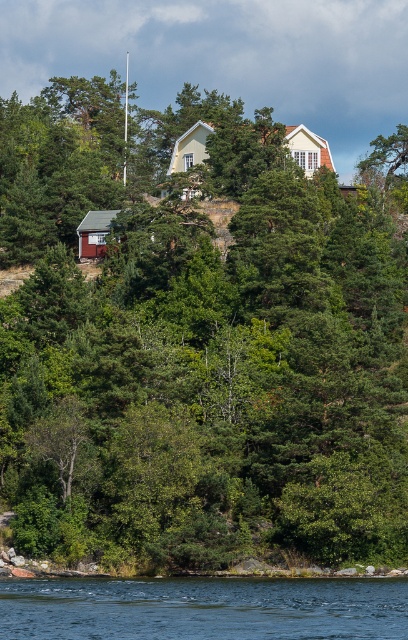
Is the position of transparent blue water at lower center more distant than that of yellow matte house at center?

No, it is in front of yellow matte house at center.

Does transparent blue water at lower center appear on the left side of yellow matte house at center?

Indeed, transparent blue water at lower center is positioned on the left side of yellow matte house at center.

Who is more distant from viewer, (x=37, y=628) or (x=168, y=164)?

Positioned behind is point (x=168, y=164).

In order to click on transparent blue water at lower center in this screenshot , I will do `click(204, 609)`.

Can you confirm if yellow matte house at center is smaller than red wooden hut at lower left?

No, yellow matte house at center is not smaller than red wooden hut at lower left.

Based on the photo, who is positioned more to the right, yellow matte house at center or red wooden hut at lower left?

yellow matte house at center is more to the right.

Identify the location of yellow matte house at center. (308, 148).

The image size is (408, 640). Find the location of `yellow matte house at center`. yellow matte house at center is located at coordinates (308, 148).

Is transparent blue water at lower center above red wooden hut at lower left?

No.

Can you confirm if transparent blue water at lower center is bigger than red wooden hut at lower left?

Yes.

Identify the location of transparent blue water at lower center. (204, 609).

Find the location of a particular element. This screenshot has width=408, height=640. transparent blue water at lower center is located at coordinates (204, 609).